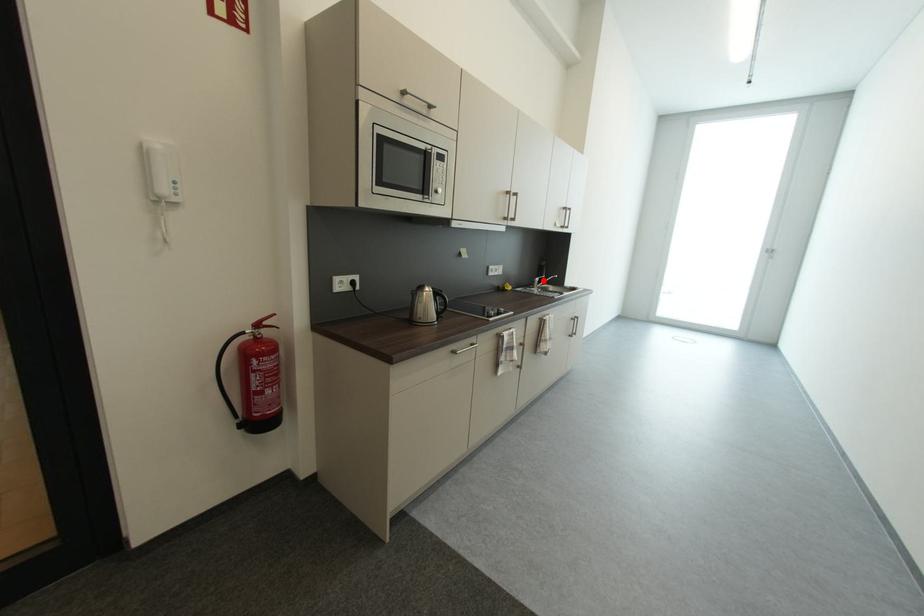
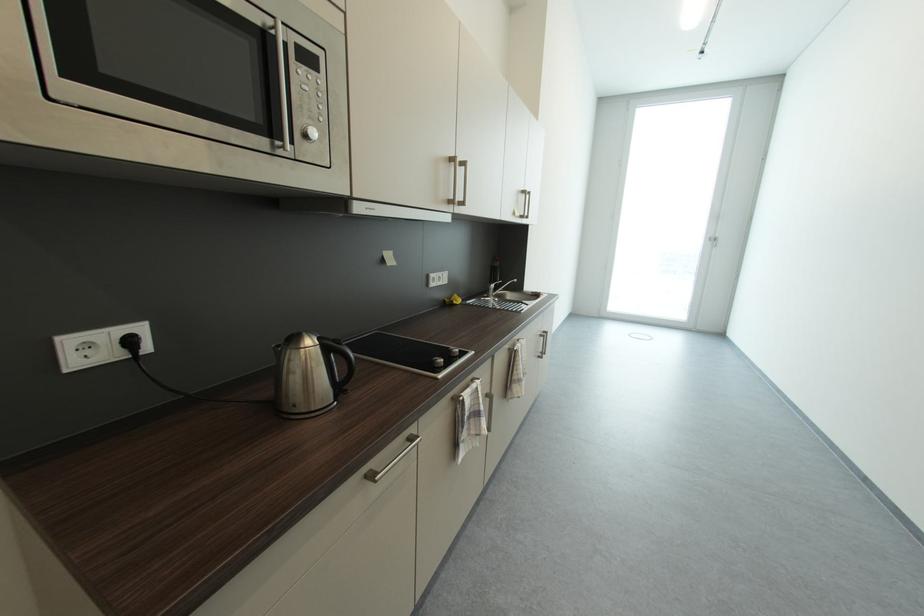
Locate, in the second image, the point that corresponds to the highlighted location in the first image.

(499, 286)